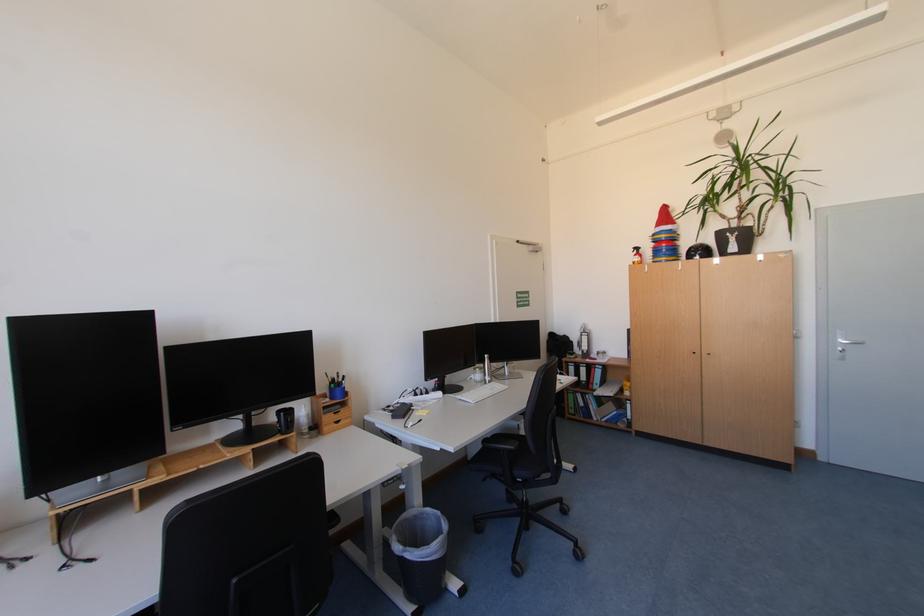
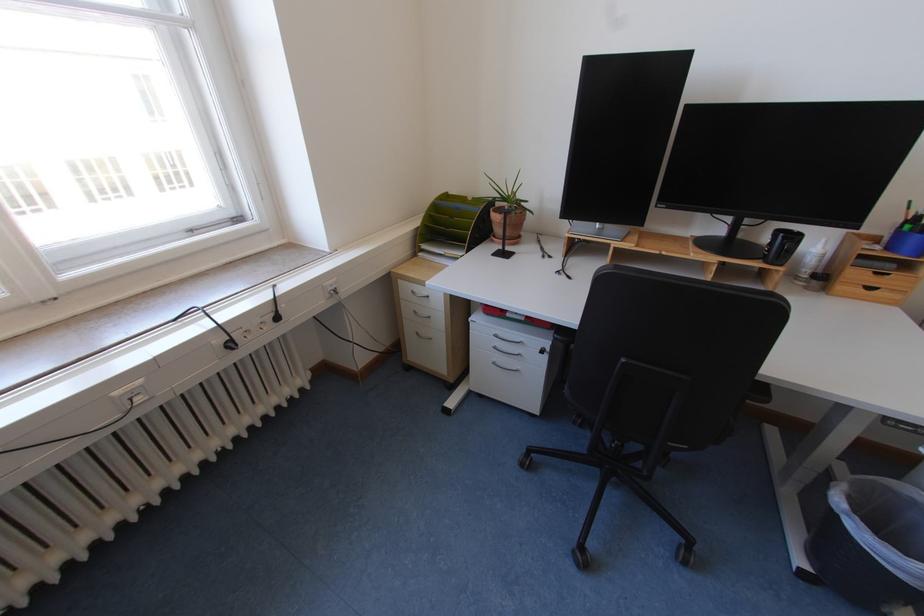
In the second image, find the point that corresponds to (x=332, y=424) in the first image.

(848, 281)